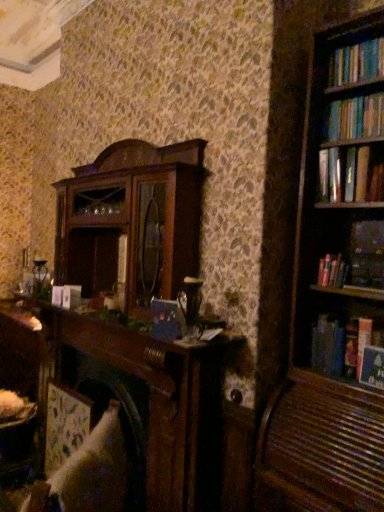
Question: Based on their sizes in the image, would you say white fabric swivel chair at lower left is bigger or smaller than hardcover book at right, positioned as the 4th book in bottom-to-top order?

Choices:
 (A) small
 (B) big

Answer: (B)

Question: Is point (104, 419) closer or farther from the camera than point (377, 232)?

Choices:
 (A) closer
 (B) farther

Answer: (A)

Question: Which is nearer to the hardcover book at right, the third book from the top?

Choices:
 (A) hardcover book at right, which is counted as the fourth book, starting from the top
 (B) hardcover book at upper right, which appears as the fifth book when ordered from the bottom
 (C) white fabric swivel chair at lower left
 (D) hardcover book at upper right, the first book from the bottom
 (E) hardcover book at right, positioned as the 4th book in bottom-to-top order

Answer: (E)

Question: Based on their relative distances, which object is nearer to the hardcover book at right, which is counted as the fourth book, starting from the top?

Choices:
 (A) hardcover book at right, positioned as the 4th book in bottom-to-top order
 (B) hardcover book at upper right, positioned as the first book in top-to-bottom order
 (C) hardcover book at upper right, the fifth book in the top-to-bottom sequence
 (D) white fabric swivel chair at lower left
 (E) hardcover book at right, positioned as the 3th book in bottom-to-top order

Answer: (C)